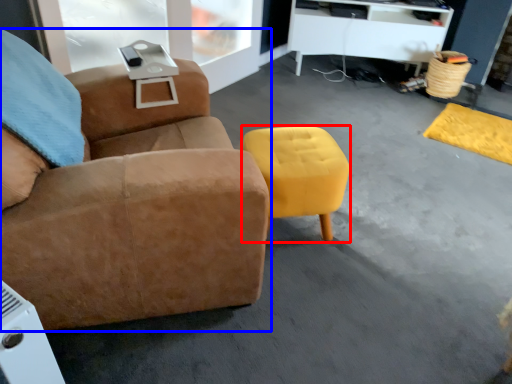
Question: Which point is closer to the camera, stool (highlighted by a red box) or chair (highlighted by a blue box)?

Choices:
 (A) stool
 (B) chair

Answer: (B)